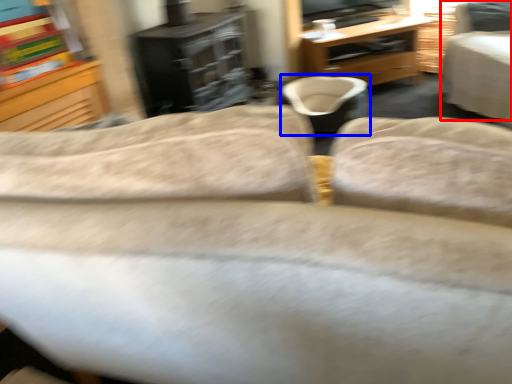
Question: Which of the following is the closest to the observer, chair (highlighted by a red box) or bean bag chair (highlighted by a blue box)?

Choices:
 (A) chair
 (B) bean bag chair

Answer: (A)